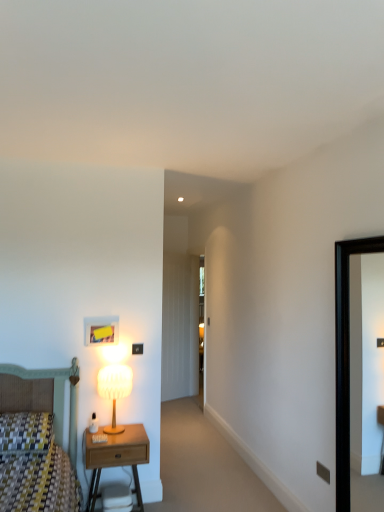
You are a GUI agent. You are given a task and a screenshot of the screen. Output one action in this format:
    pyautogui.click(x=<x>, y=<y>)
    Task: Click on the free location in front of matte white lamp at left
    The image size is (384, 512).
    Given the screenshot: What is the action you would take?
    pyautogui.click(x=117, y=437)